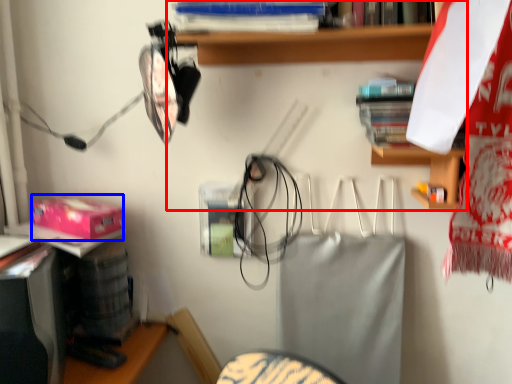
Question: Among these objects, which one is farthest to the camera, shelf (highlighted by a red box) or box (highlighted by a blue box)?

Choices:
 (A) shelf
 (B) box

Answer: (B)